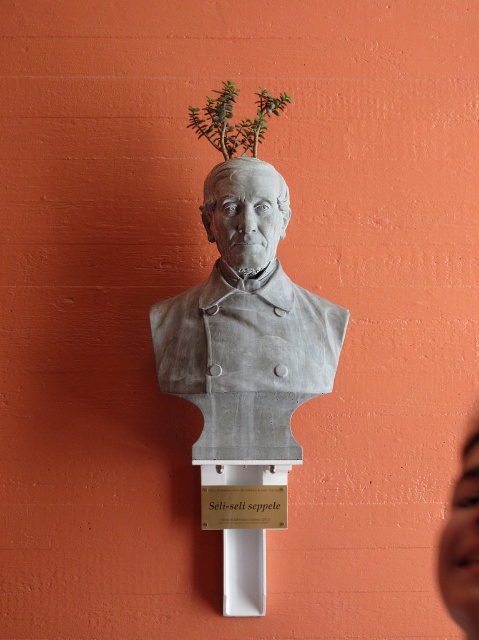
You are an art installer who needs to ensure the distance between the smooth skin face at upper right and the matte white sign at center is exactly 24.82 inches. Can you confirm if the current placement meets this requirement?

The smooth skin face at upper right and the matte white sign at center are 24.82 inches apart from each other, so yes, the current placement meets the requirement of exactly 24.82 inches between them.

You are an interior designer assessing the placement of the gray stone bust at center and the smooth skin face at upper right in a room. Which object occupies more horizontal space in the scene?

The gray stone bust at center is wider than the smooth skin face at upper right, so it occupies more horizontal space in the scene.

You are an art conservator measuring the spacing between two objects in the image. You need to know if the gap between the gray stone bust at center and the smooth skin face at upper right is more than 20 inches. Can you confirm this?

The distance between the gray stone bust at center and the smooth skin face at upper right is 21.70 inches, which is more than 20 inches.